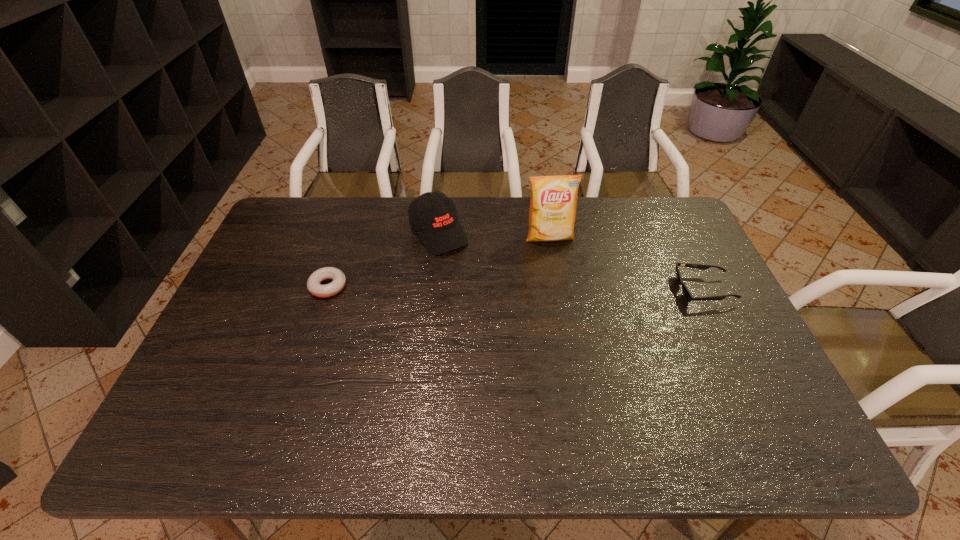
In the image, there is a desktop. What are the coordinates of `vacant space at the far edge` in the screenshot? It's located at (588, 200).

Image resolution: width=960 pixels, height=540 pixels. I want to click on vacant space at the near edge, so click(385, 387).

The image size is (960, 540). I want to click on free point at the left edge, so click(x=252, y=268).

The height and width of the screenshot is (540, 960). I want to click on vacant position at the right edge of the desktop, so click(x=692, y=246).

Locate an element on the screen. The image size is (960, 540). free space at the far left corner is located at coordinates (299, 200).

In order to click on free point at the far right corner in this screenshot , I will do `click(673, 223)`.

This screenshot has height=540, width=960. I want to click on vacant region between the rightmost object and the shortest object, so click(x=516, y=288).

You are a GUI agent. You are given a task and a screenshot of the screen. Output one action in this format:
    pyautogui.click(x=<x>, y=<y>)
    Task: Click on the unoccupied position between the third object from right to left and the rightmost object
    This screenshot has height=540, width=960.
    Given the screenshot: What is the action you would take?
    pyautogui.click(x=571, y=261)

Where is `vacant area between the doughnut and the tallest object`? vacant area between the doughnut and the tallest object is located at coordinates (439, 262).

The width and height of the screenshot is (960, 540). I want to click on free spot between the doughnut and the third object from left to right, so click(x=439, y=262).